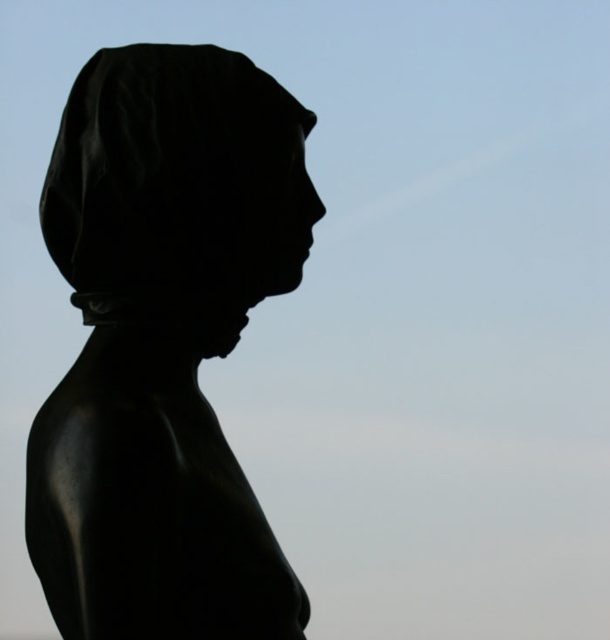
You are an art curator examining the sculpture in the image. You need to determine which part of the sculpture is wider between the black polished statue at center and the black matte head at center. Which one is wider?

The black matte head at center is wider than the black polished statue at center according to the description provided.

You are an art conservator examining the image of a statue. The statue has a point marked at coordinates (x=163, y=344). Can you identify what part of the statue this point corresponds to?

The point (x=163, y=344) marks the black polished statue at center.

You are an art critic analyzing the composition of the image. The black polished statue at center is positioned at a specific coordinate. Can you determine if the statue is placed closer to the top or bottom of the image based on its coordinates?

The black polished statue at center is located at coordinates point (163, 344). Since the y coordinate is 0.269, which is less than 0.5, the statue is closer to the bottom of the image.